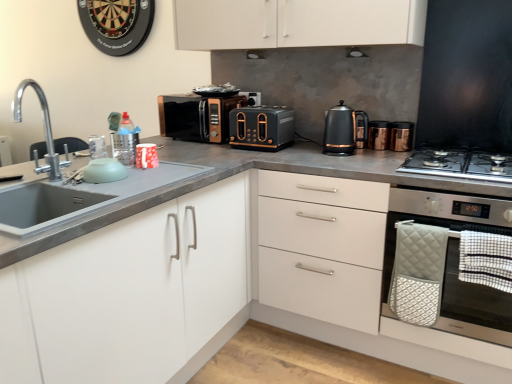
You are a GUI agent. You are given a task and a screenshot of the screen. Output one action in this format:
    pyautogui.click(x=<x>, y=<y>)
    Task: Click on the vacant space that is in between stainless steel gas stove at right and gold metallic canister at upper right, placed as the second appliance when sorted from front to back
    
    Given the screenshot: What is the action you would take?
    click(398, 152)